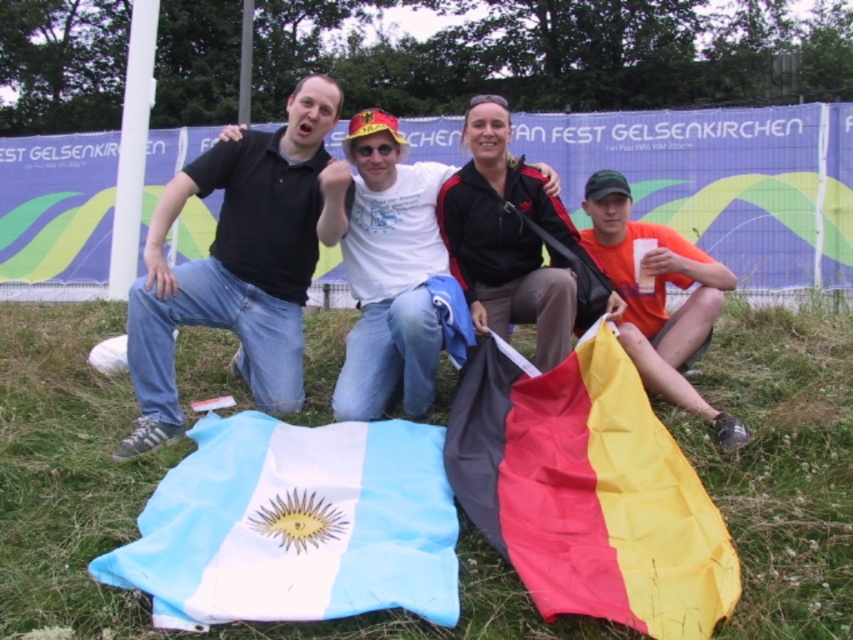
Is point (550, 179) positioned in front of point (523, 237)?

Yes, point (550, 179) is closer to viewer.

Locate an element on the screen. white matte t-shirt at center is located at coordinates (386, 266).

Is point (370, 148) in front of point (515, 198)?

Yes, point (370, 148) is closer to viewer.

Locate an element on the screen. white matte t-shirt at center is located at coordinates (386, 266).

Does white matte t-shirt at center have a lesser width compared to orange matte t-shirt at lower right?

Indeed, white matte t-shirt at center has a lesser width compared to orange matte t-shirt at lower right.

Between white matte t-shirt at center and orange matte t-shirt at lower right, which one appears on the left side from the viewer's perspective?

From the viewer's perspective, white matte t-shirt at center appears more on the left side.

Who is more distant from viewer, (x=426, y=172) or (x=657, y=352)?

The point (x=426, y=172) is more distant.

Identify the location of white matte t-shirt at center. (386, 266).

Which is behind, point (360, 476) or point (380, 144)?

Point (380, 144)

Is blue fabric flag at lower center taller than white matte t-shirt at center?

In fact, blue fabric flag at lower center may be shorter than white matte t-shirt at center.

Is point (180, 502) behind point (357, 388)?

No, it is in front of (357, 388).

Where is `blue fabric flag at lower center`? This screenshot has width=853, height=640. blue fabric flag at lower center is located at coordinates (294, 525).